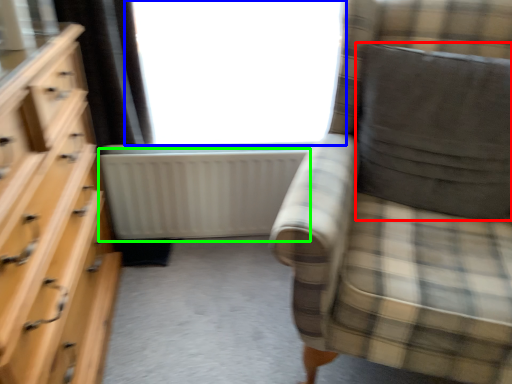
Question: Which object is the closest to the pillow (highlighted by a red box)? Choose among these: window (highlighted by a blue box) or radiator (highlighted by a green box).

Choices:
 (A) window
 (B) radiator

Answer: (A)